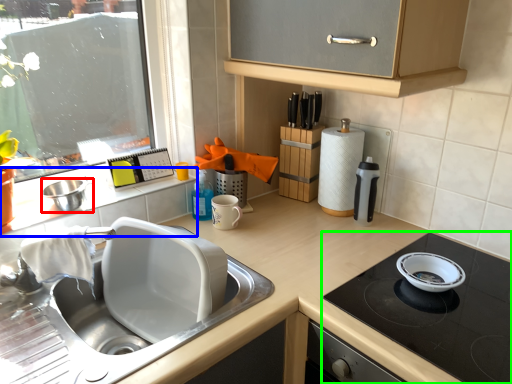
Question: Based on their relative distances, which object is nearer to mixing bowl (highlighted by a red box)? Choose from window sill (highlighted by a blue box) and gas stove (highlighted by a green box).

Choices:
 (A) window sill
 (B) gas stove

Answer: (A)